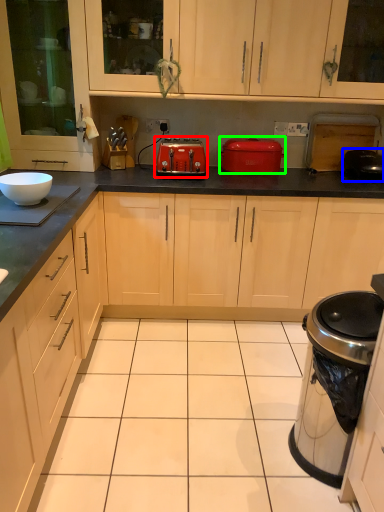
Question: Considering the real-world distances, which object is farthest from toaster (highlighted by a red box)? appliance (highlighted by a blue box) or kitchen appliance (highlighted by a green box)?

Choices:
 (A) appliance
 (B) kitchen appliance

Answer: (A)